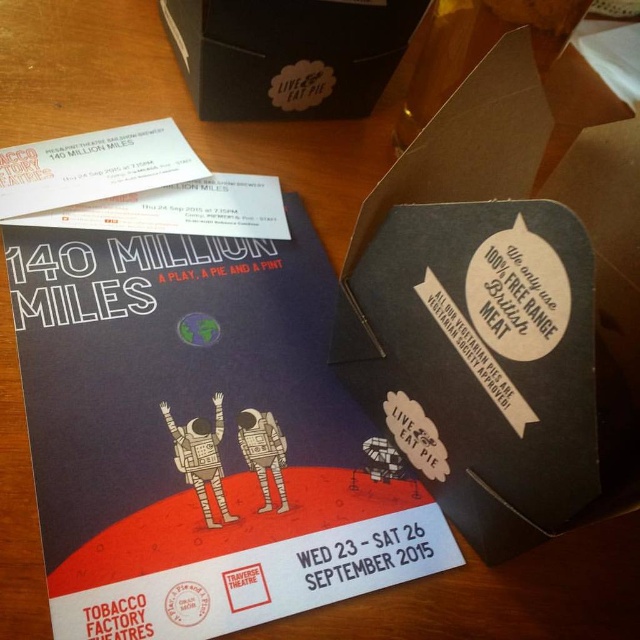
Who is more distant from viewer, (419, 547) or (252, 460)?

The point (252, 460) is behind.

Does matte black poster at center lie in front of matte gray astronaut at center?

Yes, it is.

Which is in front, point (349, 440) or point (280, 506)?

Point (280, 506) is in front.

Where is `matte black poster at center`? The image size is (640, 640). matte black poster at center is located at coordinates (198, 435).

Can you confirm if wooden astronaut at center is bigger than matte gray astronaut at center?

Indeed, wooden astronaut at center has a larger size compared to matte gray astronaut at center.

Does wooden astronaut at center come in front of matte gray astronaut at center?

Yes, wooden astronaut at center is in front of matte gray astronaut at center.

The image size is (640, 640). What do you see at coordinates (200, 458) in the screenshot?
I see `wooden astronaut at center` at bounding box center [200, 458].

You are a GUI agent. You are given a task and a screenshot of the screen. Output one action in this format:
    pyautogui.click(x=<x>, y=<y>)
    Task: Click on the wooden astronaut at center
    The height and width of the screenshot is (640, 640).
    Given the screenshot: What is the action you would take?
    pyautogui.click(x=200, y=458)

Which is above, matte black poster at center or wooden astronaut at center?

matte black poster at center is above.

Does matte black poster at center lie in front of wooden astronaut at center?

Yes, it is in front of wooden astronaut at center.

The width and height of the screenshot is (640, 640). Describe the element at coordinates (198, 435) in the screenshot. I see `matte black poster at center` at that location.

Image resolution: width=640 pixels, height=640 pixels. I want to click on matte black poster at center, so click(198, 435).